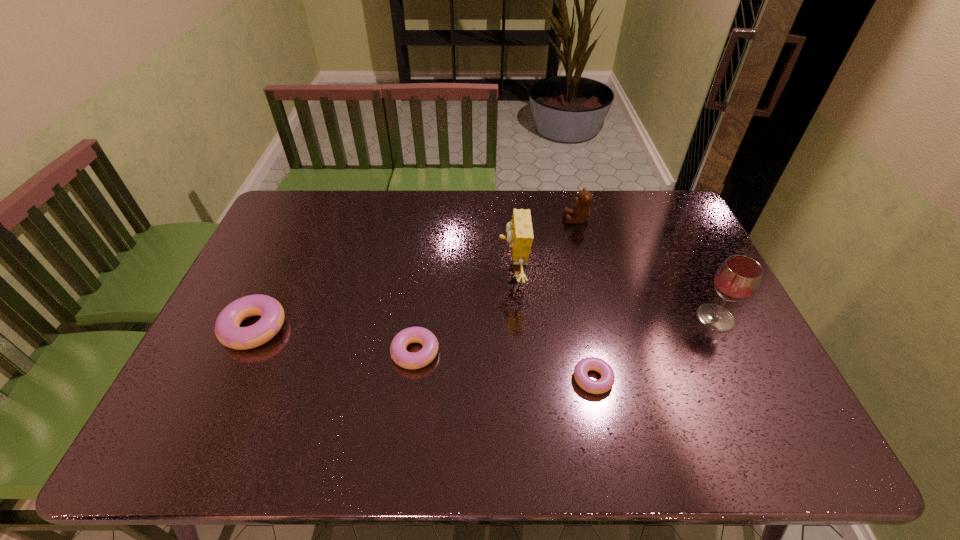
At what (x,y) coordinates should I click in order to perform the action: click on the leftmost object. Please return your answer as a coordinate pair (x, y). The width and height of the screenshot is (960, 540). Looking at the image, I should click on (227, 330).

At what (x,y) coordinates should I click in order to perform the action: click on the leftmost doughnut. Please return your answer as a coordinate pair (x, y). Looking at the image, I should click on (227, 330).

Where is `the second object from left to right`? The height and width of the screenshot is (540, 960). the second object from left to right is located at coordinates (408, 360).

Identify the location of the second tallest doughnut. This screenshot has height=540, width=960. (408, 360).

You are a GUI agent. You are given a task and a screenshot of the screen. Output one action in this format:
    pyautogui.click(x=<x>, y=<y>)
    Task: Click on the shortest object
    The image size is (960, 540).
    Given the screenshot: What is the action you would take?
    pyautogui.click(x=605, y=383)

Locate an element on the screen. This screenshot has height=540, width=960. the rightmost doughnut is located at coordinates (605, 383).

This screenshot has width=960, height=540. Identify the location of the third tallest object. (581, 211).

This screenshot has height=540, width=960. Find the location of `the farthest object`. the farthest object is located at coordinates (581, 211).

Identify the location of the rightmost object. (738, 278).

In order to click on sponge in this screenshot , I will do `click(519, 230)`.